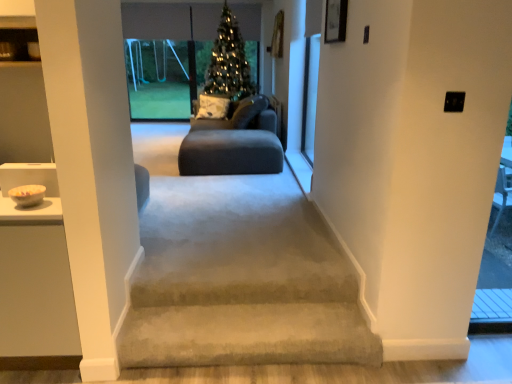
Question: Does transparent glass screen door at upper right have a greater height compared to suede-like dark gray sofa at center?

Choices:
 (A) no
 (B) yes

Answer: (B)

Question: Does transparent glass screen door at upper right have a smaller size compared to suede-like dark gray sofa at center?

Choices:
 (A) yes
 (B) no

Answer: (A)

Question: Is transparent glass screen door at upper right at the left side of suede-like dark gray sofa at center?

Choices:
 (A) yes
 (B) no

Answer: (B)

Question: From the image's perspective, does transparent glass screen door at upper right appear lower than suede-like dark gray sofa at center?

Choices:
 (A) yes
 (B) no

Answer: (B)

Question: Would you say transparent glass screen door at upper right is outside suede-like dark gray sofa at center?

Choices:
 (A) yes
 (B) no

Answer: (A)

Question: Is suede-like dark gray sofa at center at the back of transparent glass screen door at upper right?

Choices:
 (A) yes
 (B) no

Answer: (B)

Question: Does transparent glass screen door at upper right have a greater width compared to green matte christmas tree at center?

Choices:
 (A) no
 (B) yes

Answer: (A)

Question: From the image's perspective, does transparent glass screen door at upper right appear lower than green matte christmas tree at center?

Choices:
 (A) yes
 (B) no

Answer: (A)

Question: From a real-world perspective, is transparent glass screen door at upper right on green matte christmas tree at center?

Choices:
 (A) yes
 (B) no

Answer: (B)

Question: Can you confirm if transparent glass screen door at upper right is positioned to the right of green matte christmas tree at center?

Choices:
 (A) no
 (B) yes

Answer: (B)

Question: Is transparent glass screen door at upper right outside green matte christmas tree at center?

Choices:
 (A) yes
 (B) no

Answer: (A)

Question: Would you say transparent glass screen door at upper right is a long distance from green matte christmas tree at center?

Choices:
 (A) yes
 (B) no

Answer: (A)

Question: Can you confirm if green matte christmas tree at center is bigger than transparent glass swing set at upper center?

Choices:
 (A) no
 (B) yes

Answer: (B)